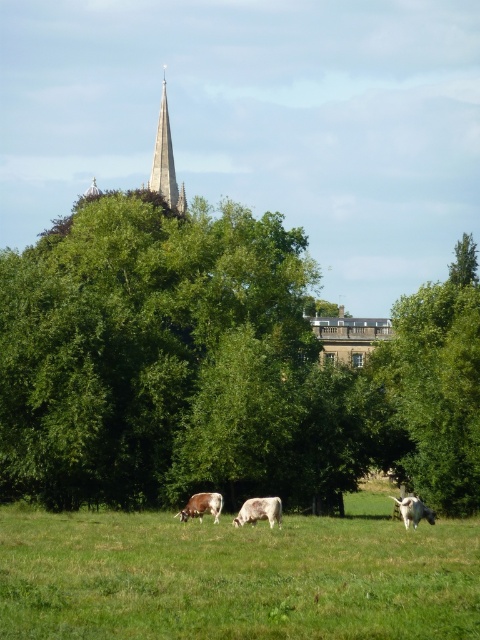
Is green leafy tree at upper left thinner than brown speckled cow at center?

No.

Which is behind, point (10, 470) or point (220, 499)?

The point (10, 470) is more distant.

This screenshot has height=640, width=480. Find the location of `green leafy tree at upper left`. green leafy tree at upper left is located at coordinates (130, 337).

Is green leafy tree at upper left further to the viewer compared to smooth stone spire at upper center?

That is False.

Does green leafy tree at upper left have a smaller size compared to smooth stone spire at upper center?

No, green leafy tree at upper left is not smaller than smooth stone spire at upper center.

Who is more distant from viewer, (x=162, y=220) or (x=179, y=192)?

Point (x=179, y=192)

The height and width of the screenshot is (640, 480). I want to click on green leafy tree at upper left, so click(x=130, y=337).

Which is behind, point (146, 458) or point (31, 568)?

Point (146, 458)

Can you confirm if green leafy tree at upper left is bigger than green grass at center?

Correct, green leafy tree at upper left is larger in size than green grass at center.

This screenshot has width=480, height=640. In order to click on green leafy tree at upper left in this screenshot , I will do `click(130, 337)`.

Where is `green leafy tree at upper left`? This screenshot has width=480, height=640. green leafy tree at upper left is located at coordinates (130, 337).